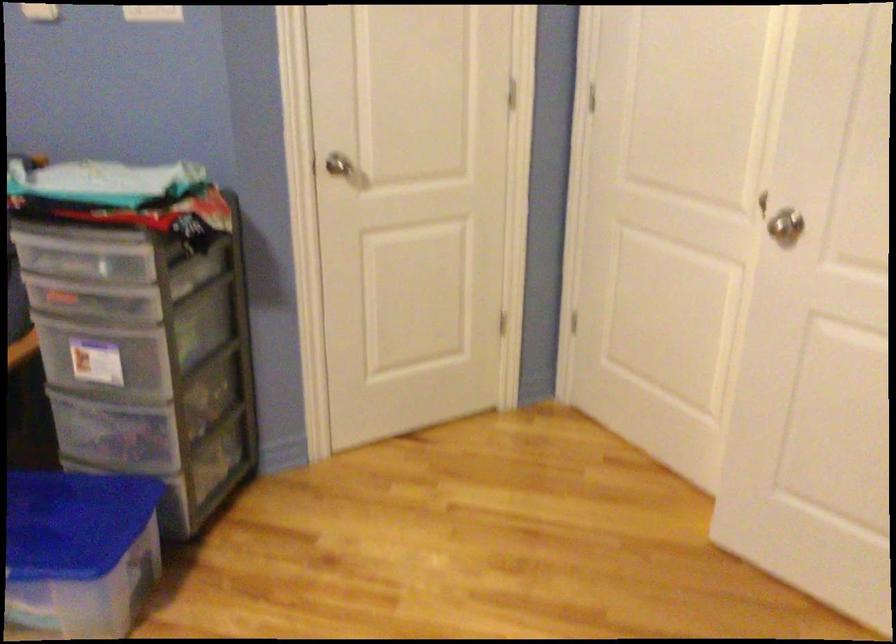
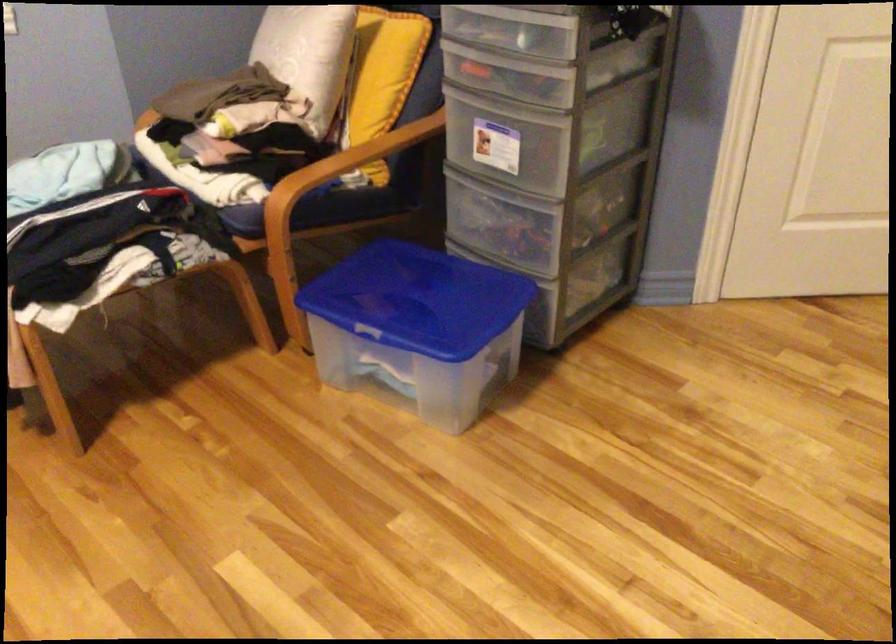
Question: The first image is from the beginning of the video and the second image is from the end. How did the camera likely rotate when shooting the video?

Choices:
 (A) Left
 (B) Right
 (C) Up
 (D) Down

Answer: (A)